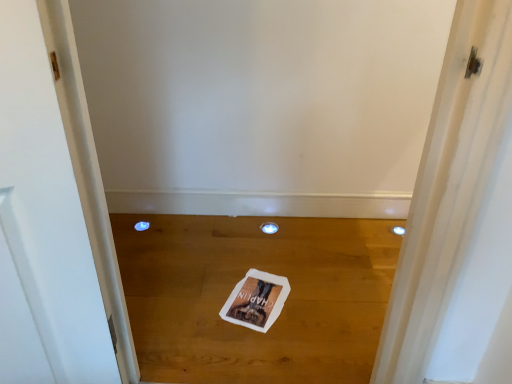
Image resolution: width=512 pixels, height=384 pixels. I want to click on free space in front of white paper magazine at center, so click(x=257, y=346).